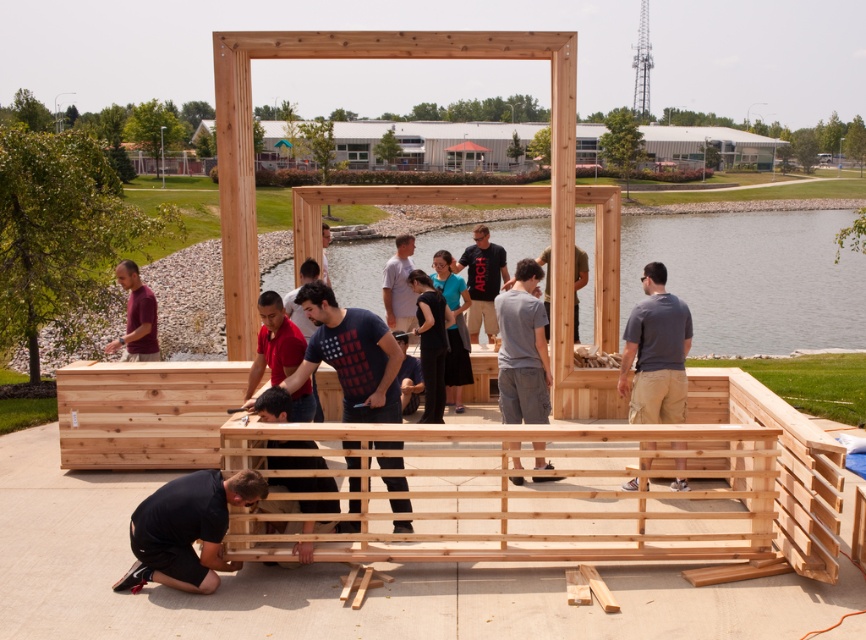
Question: Estimate the real-world distances between objects in this image. Which object is closer to the clear water at center?

Choices:
 (A) maroon shirt at left
 (B) black matte construction worker at lower left

Answer: (B)

Question: Which of the following is the farthest from the observer?

Choices:
 (A) black matte construction worker at lower left
 (B) clear water at center
 (C) maroon shirt at left

Answer: (B)

Question: Is clear water at center positioned behind maroon shirt at left?

Choices:
 (A) no
 (B) yes

Answer: (B)

Question: Is clear water at center wider than black matte construction worker at lower left?

Choices:
 (A) no
 (B) yes

Answer: (B)

Question: Does black matte construction worker at lower left appear on the right side of maroon shirt at left?

Choices:
 (A) yes
 (B) no

Answer: (A)

Question: Which of the following is the closest to the observer?

Choices:
 (A) (121, 339)
 (B) (236, 477)

Answer: (B)